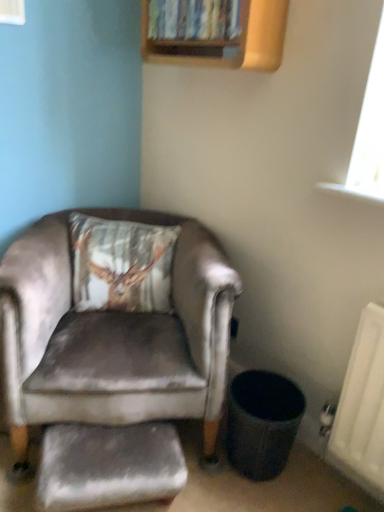
What do you see at coordinates (121, 264) in the screenshot? I see `velvet-like brown pillow at upper left` at bounding box center [121, 264].

Where is `wooden bookshelf at upper center`? Image resolution: width=384 pixels, height=512 pixels. wooden bookshelf at upper center is located at coordinates (215, 33).

This screenshot has width=384, height=512. Describe the element at coordinates (113, 336) in the screenshot. I see `satin grey armchair at left` at that location.

In order to click on satin grey armchair at left in this screenshot , I will do `click(113, 336)`.

Measure the distance between velvet grey footrest at lower left and camera.

velvet grey footrest at lower left is 3.61 feet away from camera.

Identify the location of velvet grey footrest at lower left. The height and width of the screenshot is (512, 384). (108, 466).

At what (x,y) coordinates should I click in order to perform the action: click on transparent glass window at upper left. Please return your answer as a coordinate pair (x, y). Looking at the image, I should click on (12, 12).

Which of these two, transparent glass window at upper left or satin grey armchair at left, is smaller?

Smaller between the two is transparent glass window at upper left.

Does transparent glass window at upper left contain satin grey armchair at left?

No, satin grey armchair at left is not a part of transparent glass window at upper left.

From the image's perspective, who appears lower, transparent glass window at upper left or satin grey armchair at left?

satin grey armchair at left is shown below in the image.

Is transparent glass window at upper left surrounding wooden bookshelf at upper center?

No, transparent glass window at upper left does not contain wooden bookshelf at upper center.

In terms of width, does transparent glass window at upper left look wider or thinner when compared to wooden bookshelf at upper center?

Considering their sizes, transparent glass window at upper left looks slimmer than wooden bookshelf at upper center.

Does transparent glass window at upper left appear on the right side of wooden bookshelf at upper center?

In fact, transparent glass window at upper left is to the left of wooden bookshelf at upper center.

Considering the relative positions of wooden bookshelf at upper center and velvet-like brown pillow at upper left in the image provided, is wooden bookshelf at upper center in front of velvet-like brown pillow at upper left?

That is True.

Is velvet-like brown pillow at upper left located within wooden bookshelf at upper center?

Actually, velvet-like brown pillow at upper left is outside wooden bookshelf at upper center.

Who is taller, wooden bookshelf at upper center or velvet-like brown pillow at upper left?

velvet-like brown pillow at upper left.

Does wooden bookshelf at upper center turn towards velvet-like brown pillow at upper left?

No, wooden bookshelf at upper center is not turned towards velvet-like brown pillow at upper left.

Considering the relative positions of transparent glass window at upper left and velvet-like brown pillow at upper left in the image provided, is transparent glass window at upper left in front of velvet-like brown pillow at upper left?

Yes, it is.

Between transparent glass window at upper left and velvet-like brown pillow at upper left, which one has smaller size?

Smaller between the two is transparent glass window at upper left.

Does point (12, 14) appear closer or farther from the camera than point (136, 302)?

Point (12, 14) is positioned closer to the camera compared to point (136, 302).

Is point (134, 426) in front of point (9, 4)?

Yes, point (134, 426) is closer to viewer.

Is velvet grey footrest at lower left oriented towards transparent glass window at upper left?

No, velvet grey footrest at lower left is not facing towards transparent glass window at upper left.

What's the angular difference between velvet grey footrest at lower left and transparent glass window at upper left's facing directions?

28.6 degrees separate the facing orientations of velvet grey footrest at lower left and transparent glass window at upper left.

From a real-world perspective, is velvet grey footrest at lower left under transparent glass window at upper left?

Yes, from a real-world perspective, velvet grey footrest at lower left is beneath transparent glass window at upper left.

Is velvet-like brown pillow at upper left positioned with its back to transparent glass window at upper left?

velvet-like brown pillow at upper left is not turned away from transparent glass window at upper left.

I want to click on window in front of the velvet-like brown pillow at upper left, so click(12, 12).

In terms of width, does velvet-like brown pillow at upper left look wider or thinner when compared to transparent glass window at upper left?

Considering their sizes, velvet-like brown pillow at upper left looks broader than transparent glass window at upper left.

Which of these two, velvet-like brown pillow at upper left or transparent glass window at upper left, is smaller?

Smaller between the two is transparent glass window at upper left.

Does wooden bookshelf at upper center turn towards transparent glass window at upper left?

Yes.

Can you confirm if wooden bookshelf at upper center is shorter than transparent glass window at upper left?

Yes.

In the image, is wooden bookshelf at upper center positioned in front of or behind transparent glass window at upper left?

Visually, wooden bookshelf at upper center is located behind transparent glass window at upper left.

Is wooden bookshelf at upper center inside or outside of transparent glass window at upper left?

wooden bookshelf at upper center is not inside transparent glass window at upper left, it's outside.

Find the location of a particular element. The width and height of the screenshot is (384, 512). window on the left of satin grey armchair at left is located at coordinates [x=12, y=12].

The image size is (384, 512). What are the coordinates of `bookshelf below the transparent glass window at upper left (from a real-world perspective)` in the screenshot? It's located at (215, 33).

From the picture: Based on their spatial positions, is satin grey armchair at left or transparent glass window at upper left further from velvet-like brown pillow at upper left?

transparent glass window at upper left.

Considering their positions, is satin grey armchair at left positioned closer to velvet-like brown pillow at upper left than wooden bookshelf at upper center?

Based on the image, satin grey armchair at left appears to be nearer to velvet-like brown pillow at upper left.

Consider the image. Considering their positions, is velvet grey footrest at lower left positioned closer to velvet-like brown pillow at upper left than transparent glass window at upper left?

Among the two, velvet grey footrest at lower left is located nearer to velvet-like brown pillow at upper left.

Estimate the real-world distances between objects in this image. Which object is further from velvet grey footrest at lower left, wooden bookshelf at upper center or transparent glass window at upper left?

transparent glass window at upper left.

Estimate the real-world distances between objects in this image. Which object is closer to velvet grey footrest at lower left, satin grey armchair at left or transparent glass window at upper left?

The object closer to velvet grey footrest at lower left is satin grey armchair at left.

When comparing their distances from velvet grey footrest at lower left, does transparent glass window at upper left or wooden bookshelf at upper center seem closer?

wooden bookshelf at upper center is closer to velvet grey footrest at lower left.

Looking at the image, which one is located closer to transparent glass window at upper left, satin grey armchair at left or wooden bookshelf at upper center?

The object closer to transparent glass window at upper left is wooden bookshelf at upper center.

Which object lies nearer to the anchor point satin grey armchair at left, transparent glass window at upper left or wooden bookshelf at upper center?

Among the two, wooden bookshelf at upper center is located nearer to satin grey armchair at left.

This screenshot has height=512, width=384. Identify the location of chair between velvet-like brown pillow at upper left and velvet grey footrest at lower left in the vertical direction. (113, 336).

At what (x,y) coordinates should I click in order to perform the action: click on pillow between wooden bookshelf at upper center and velvet grey footrest at lower left in the vertical direction. Please return your answer as a coordinate pair (x, y). This screenshot has height=512, width=384. Looking at the image, I should click on (121, 264).

The image size is (384, 512). Identify the location of chair that lies between transparent glass window at upper left and velvet grey footrest at lower left from top to bottom. (113, 336).

At what (x,y) coordinates should I click in order to perform the action: click on chair between wooden bookshelf at upper center and velvet grey footrest at lower left vertically. Please return your answer as a coordinate pair (x, y). The width and height of the screenshot is (384, 512). Looking at the image, I should click on (113, 336).